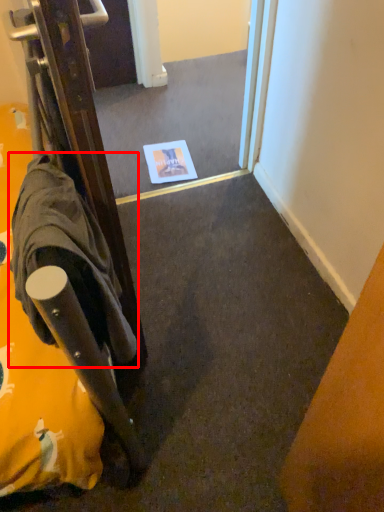
Question: In this image, where is robe (annotated by the red box) located relative to mirror?

Choices:
 (A) right
 (B) left

Answer: (B)